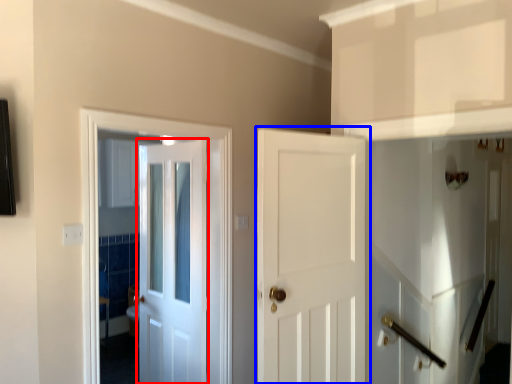
Question: Which object is closer to the camera taking this photo, door (highlighted by a red box) or door (highlighted by a blue box)?

Choices:
 (A) door
 (B) door

Answer: (B)